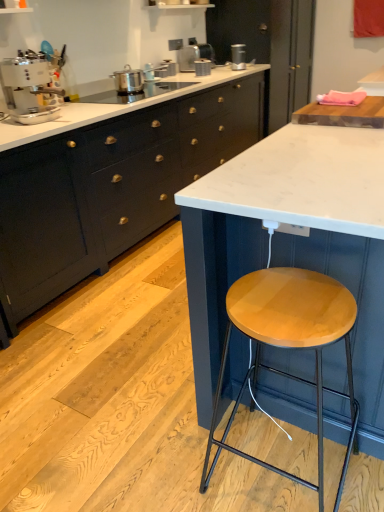
Question: Is matte black cabinet at center, acting as the first cabinetry starting from the right, not inside wooden cutting board at upper right, which is the 1th countertop in top-to-bottom order?

Choices:
 (A) no
 (B) yes

Answer: (B)

Question: From the image's perspective, is matte black cabinet at center, acting as the first cabinetry starting from the right, located above wooden cutting board at upper right, the 2th countertop positioned from the bottom?

Choices:
 (A) yes
 (B) no

Answer: (A)

Question: Can you confirm if matte black cabinet at center, acting as the first cabinetry starting from the right, is positioned to the right of wooden cutting board at upper right, which is the 1th countertop in top-to-bottom order?

Choices:
 (A) yes
 (B) no

Answer: (A)

Question: From the image's perspective, is matte black cabinet at center, acting as the first cabinetry starting from the right, located beneath wooden cutting board at upper right, which is the 1th countertop in top-to-bottom order?

Choices:
 (A) yes
 (B) no

Answer: (B)

Question: Can you confirm if matte black cabinet at center, the second cabinetry positioned from the left, is taller than wooden cutting board at upper right, which is the 1th countertop in top-to-bottom order?

Choices:
 (A) yes
 (B) no

Answer: (A)

Question: Looking at their shapes, would you say matte black cabinet at center, the second cabinetry positioned from the left, is wider or thinner than white glossy coffee machine at upper left, positioned as the 1th appliance in front-to-back order?

Choices:
 (A) thin
 (B) wide

Answer: (B)

Question: From a real-world perspective, is matte black cabinet at center, the second cabinetry positioned from the left, positioned above or below white glossy coffee machine at upper left, marked as the first appliance in a left-to-right arrangement?

Choices:
 (A) above
 (B) below

Answer: (B)

Question: Visually, is matte black cabinet at center, acting as the first cabinetry starting from the right, positioned to the left or to the right of white glossy coffee machine at upper left, which appears as the 5th appliance when viewed from the top?

Choices:
 (A) right
 (B) left

Answer: (A)

Question: In the image, is matte black cabinet at center, acting as the first cabinetry starting from the right, positioned in front of or behind white glossy coffee machine at upper left, acting as the 5th appliance starting from the back?

Choices:
 (A) front
 (B) behind

Answer: (B)

Question: In terms of width, does wooden seat stool at center look wider or thinner when compared to satin silver toaster at upper center, acting as the fourth appliance starting from the bottom?

Choices:
 (A) thin
 (B) wide

Answer: (B)

Question: Is wooden seat stool at center taller or shorter than satin silver toaster at upper center, acting as the fourth appliance starting from the bottom?

Choices:
 (A) short
 (B) tall

Answer: (B)

Question: Is point (326, 330) closer or farther from the camera than point (233, 57)?

Choices:
 (A) farther
 (B) closer

Answer: (B)

Question: Visually, is wooden seat stool at center positioned to the left or to the right of satin silver toaster at upper center, which appears as the 2th appliance when viewed from the back?

Choices:
 (A) right
 (B) left

Answer: (B)

Question: From the image's perspective, is satin silver toaster at upper center, which is counted as the fourth appliance, starting from the right, positioned above or below satin silver toaster at upper center, which is counted as the 4th appliance, starting from the front?

Choices:
 (A) above
 (B) below

Answer: (B)

Question: Do you think satin silver toaster at upper center, the 3th appliance when ordered from top to bottom, is within satin silver toaster at upper center, the 1th appliance viewed from the right, or outside of it?

Choices:
 (A) outside
 (B) inside

Answer: (A)